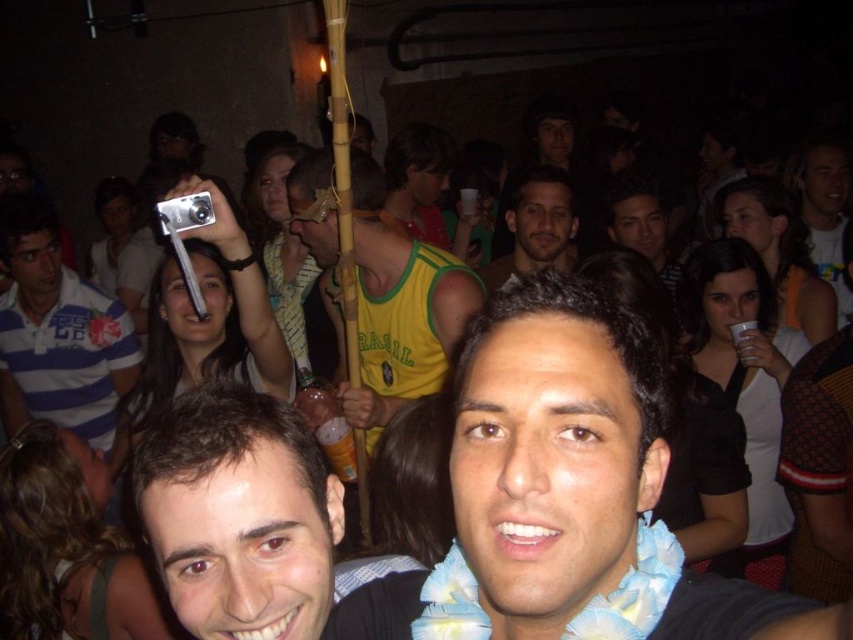
You are a photographer holding a camera. You want to capture a closeup shot of the blue floral shirt at center without moving the camera. Can you do it?

The blue floral shirt at center and camera are 17.60 inches apart from each other. Since the camera is already positioned at this distance, you can capture a closeup shot of the blue floral shirt at center without moving the camera.

You are organizing a charity event and need to choose a tshirt that is bigger between the yellow jersey at center and the blue striped polo shirt at left. Which one should you pick?

The yellow jersey at center is larger in size than the blue striped polo shirt at left, so you should pick the yellow jersey at center.

Based on the scene description, can you identify what is located at the coordinates point [399,307]?

The yellow jersey at center is located at point [399,307].